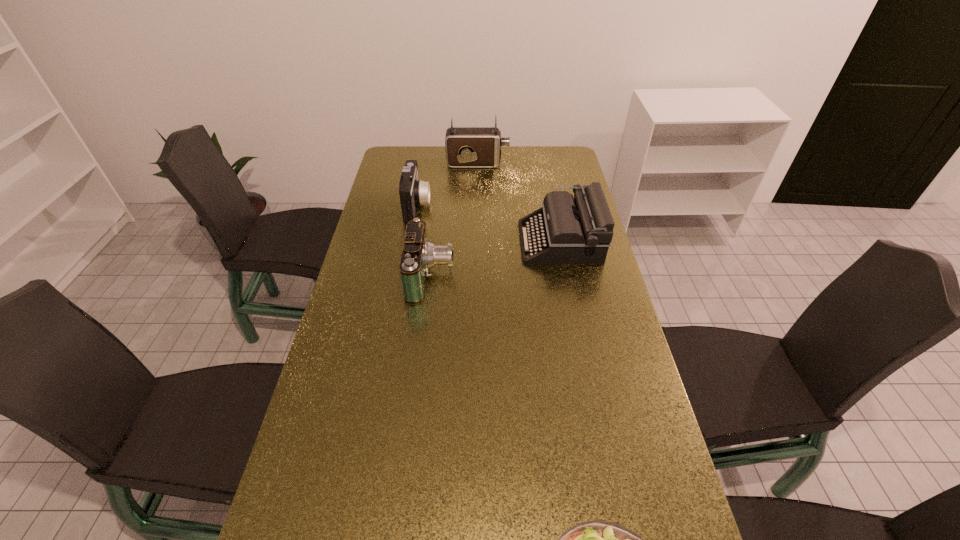
The width and height of the screenshot is (960, 540). What are the coordinates of `free location located on the lens of the second farthest camcorder` in the screenshot? It's located at (462, 205).

This screenshot has width=960, height=540. Find the location of `object positioned at the far edge`. object positioned at the far edge is located at coordinates click(x=466, y=147).

The image size is (960, 540). I want to click on object located in the left edge section of the desktop, so click(x=412, y=192).

Where is `object present at the right edge`? object present at the right edge is located at coordinates (565, 230).

Where is `vacant position at the far edge of the desktop`? The image size is (960, 540). vacant position at the far edge of the desktop is located at coordinates (529, 161).

In the image, there is a desktop. Identify the location of vacant space at the left edge. The image size is (960, 540). (355, 399).

Identify the location of vacant space at the right edge of the desktop. (566, 327).

You are a GUI agent. You are given a task and a screenshot of the screen. Output one action in this format:
    pyautogui.click(x=<x>, y=<y>)
    Task: Click on the vacant space at the far right corner of the desktop
    
    Given the screenshot: What is the action you would take?
    pyautogui.click(x=557, y=168)

Locate an element on the screen. Image resolution: width=960 pixels, height=540 pixels. vacant region between the tallest camcorder and the typewriter is located at coordinates (518, 202).

The height and width of the screenshot is (540, 960). What are the coordinates of `free spot between the nearest camcorder and the tallest object` in the screenshot? It's located at (454, 219).